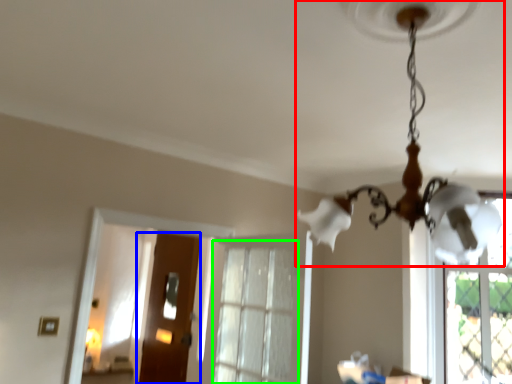
Question: Estimate the real-world distances between objects in this image. Which object is closer to lamp (highlighted by a red box), door (highlighted by a blue box) or window (highlighted by a green box)?

Choices:
 (A) door
 (B) window

Answer: (B)